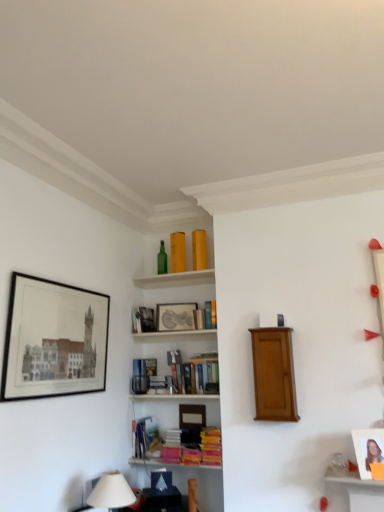
Question: Is hardcover book at lower center, acting as the fourth book starting from the top, situated inside mahogany wood cabinet at center or outside?

Choices:
 (A) inside
 (B) outside

Answer: (B)

Question: From the image's perspective, is hardcover book at lower center, marked as the 1th book in a bottom-to-top arrangement, positioned above or below mahogany wood cabinet at center?

Choices:
 (A) above
 (B) below

Answer: (B)

Question: Which object is the farthest from the matte white photo frame at lower right, positioned as the third picture frame in left-to-right order?

Choices:
 (A) hardcover book at center, the 3th book positioned from the bottom
 (B) matte glass bottles at upper center
 (C) white fabric lampshade at lower left
 (D) matte black picture frame at center, positioned as the 2th picture frame in left-to-right order
 (E) hardcover book at lower center, acting as the fourth book starting from the top

Answer: (B)

Question: Based on their relative distances, which object is nearer to the green glass bottle at upper center?

Choices:
 (A) matte white photo frame at lower right, arranged as the first picture frame when viewed from the right
 (B) hardcover book at upper center, marked as the 4th book in a bottom-to-top arrangement
 (C) matte black picture frame at center, the 2th picture frame in the right-to-left sequence
 (D) hardcover book at center, the 3th book positioned from the bottom
 (E) mahogany wood cabinet at center

Answer: (C)